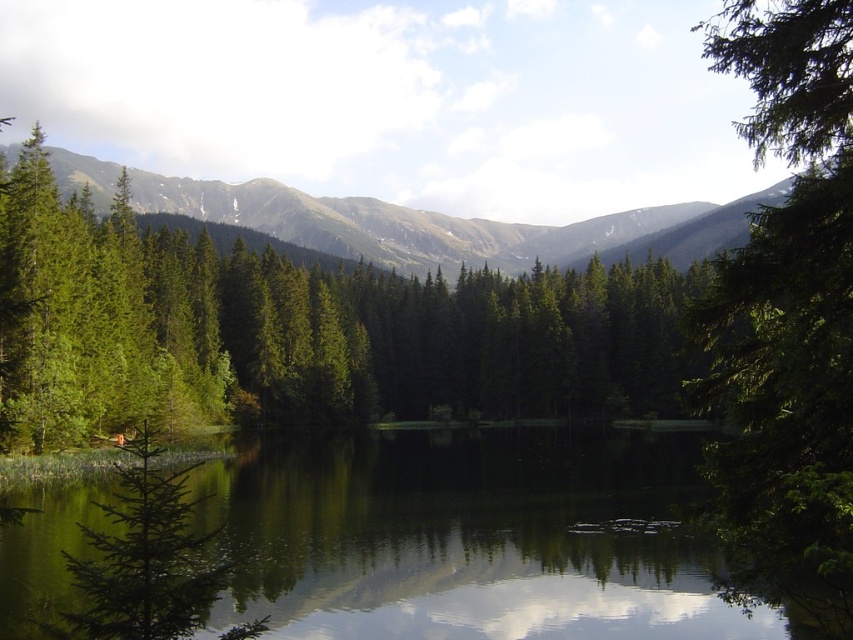
Does green reflective water at center appear under green matte tree at lower left?

Yes.

Can you confirm if green reflective water at center is positioned to the right of green matte tree at lower left?

Yes, green reflective water at center is to the right of green matte tree at lower left.

Is point (64, 538) positioned in front of point (184, 570)?

No, it is behind (184, 570).

In order to click on green reflective water at center in this screenshot , I will do `click(474, 538)`.

Which is more to the left, green reflective water at center or green textured forest at upper center?

green textured forest at upper center is more to the left.

Does green reflective water at center appear on the left side of green textured forest at upper center?

Incorrect, green reflective water at center is not on the left side of green textured forest at upper center.

Who is more distant from viewer, (547,483) or (357,234)?

Point (357,234)

Locate an element on the screen. green reflective water at center is located at coordinates (474, 538).

Which is behind, point (749, 324) or point (123, 504)?

Positioned behind is point (749, 324).

Can you confirm if green leafy tree at right is shorter than green matte tree at lower left?

Incorrect, green leafy tree at right's height does not fall short of green matte tree at lower left's.

Describe the element at coordinates (788, 301) in the screenshot. I see `green leafy tree at right` at that location.

Image resolution: width=853 pixels, height=640 pixels. Find the location of `green leafy tree at right`. green leafy tree at right is located at coordinates (788, 301).